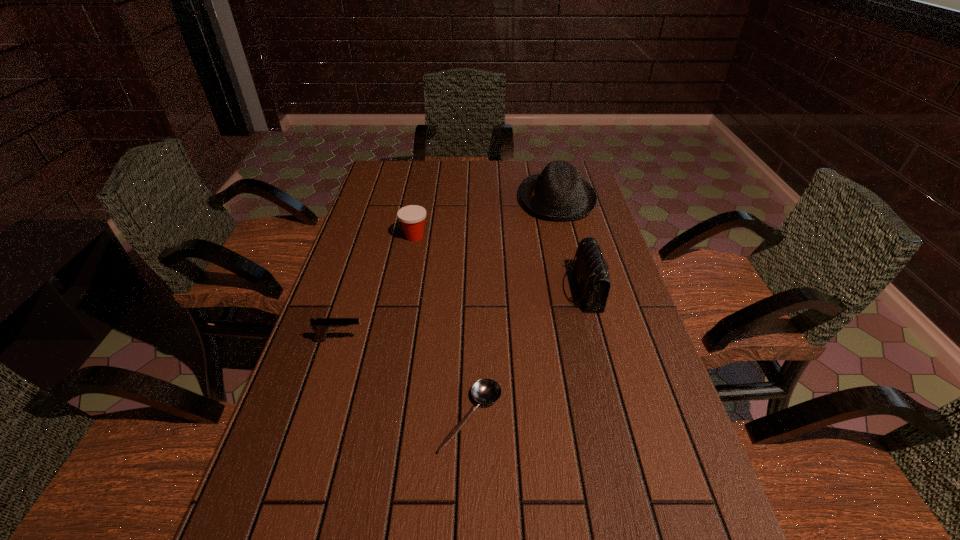
Identify the location of fedora that is at the right edge. This screenshot has height=540, width=960. (559, 193).

Identify the location of clutch bag located at the right edge. Image resolution: width=960 pixels, height=540 pixels. (591, 272).

What are the coordinates of `object positioned at the far right corner` in the screenshot? It's located at click(559, 193).

This screenshot has height=540, width=960. In the image, there is a desktop. Find the location of `vacant area at the far edge`. vacant area at the far edge is located at coordinates (500, 171).

In the image, there is a desktop. In order to click on free region at the left edge in this screenshot , I will do `click(331, 411)`.

Where is `free spot at the right edge of the desktop`? Image resolution: width=960 pixels, height=540 pixels. free spot at the right edge of the desktop is located at coordinates (644, 453).

Locate an element on the screen. vacant space at the far left corner is located at coordinates (406, 165).

The width and height of the screenshot is (960, 540). Find the location of `free space at the far right corner`. free space at the far right corner is located at coordinates (583, 173).

Identify the location of vacant space in between the ladle and the third shortest object. The height and width of the screenshot is (540, 960). (443, 327).

You are a GUI agent. You are given a task and a screenshot of the screen. Output one action in this format:
    pyautogui.click(x=<x>, y=<y>)
    Task: Click on the empty space that is in between the shortest object and the second farthest object
    The image size is (960, 540).
    Given the screenshot: What is the action you would take?
    pyautogui.click(x=443, y=327)